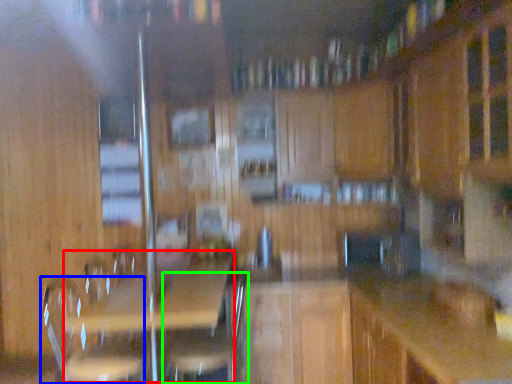
Question: Which object is positioned closest to picnic table (highlighted by a red box)? Select from swivel chair (highlighted by a blue box) and swivel chair (highlighted by a green box).

Choices:
 (A) swivel chair
 (B) swivel chair

Answer: (B)